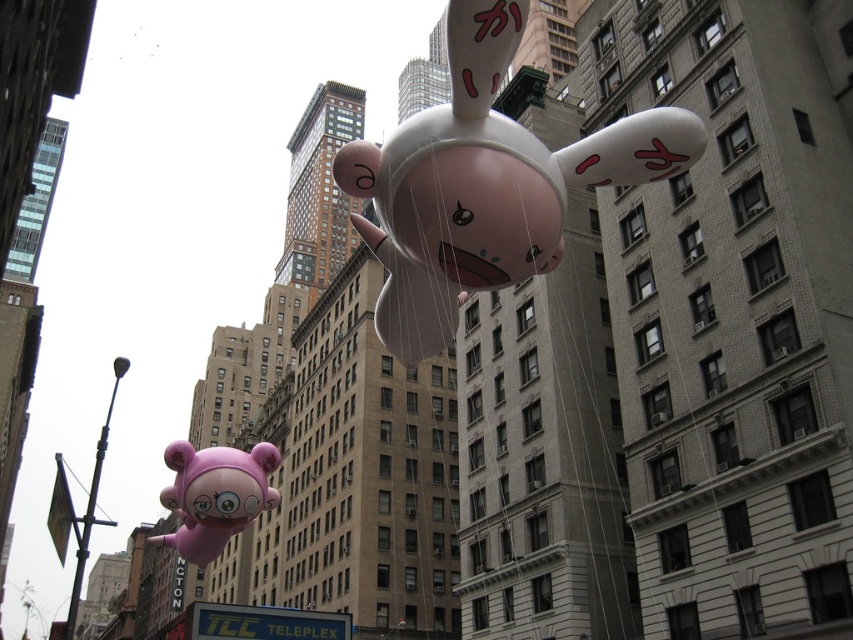
Question: Which object is closer to the camera taking this photo?

Choices:
 (A) pink rubber balloon at center
 (B) matte pink balloon at lower left

Answer: (A)

Question: Can you confirm if pink rubber balloon at center is thinner than matte pink balloon at lower left?

Choices:
 (A) no
 (B) yes

Answer: (B)

Question: Is pink rubber balloon at center bigger than matte pink balloon at lower left?

Choices:
 (A) yes
 (B) no

Answer: (B)

Question: Does pink rubber balloon at center have a greater width compared to matte pink balloon at lower left?

Choices:
 (A) no
 (B) yes

Answer: (A)